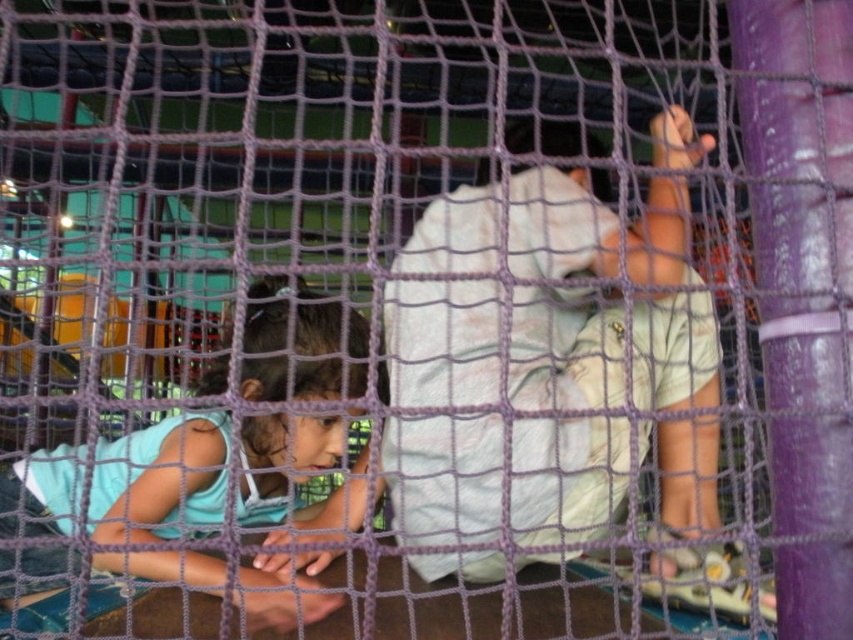
Is point (465, 480) positioned behind point (61, 548)?

No.

Which is below, white cotton shirt at center or light blue fabric at lower left?

light blue fabric at lower left

Locate an element on the screen. The width and height of the screenshot is (853, 640). white cotton shirt at center is located at coordinates (538, 349).

At what (x,y) coordinates should I click in order to perform the action: click on white cotton shirt at center. Please return your answer as a coordinate pair (x, y). The height and width of the screenshot is (640, 853). Looking at the image, I should click on (538, 349).